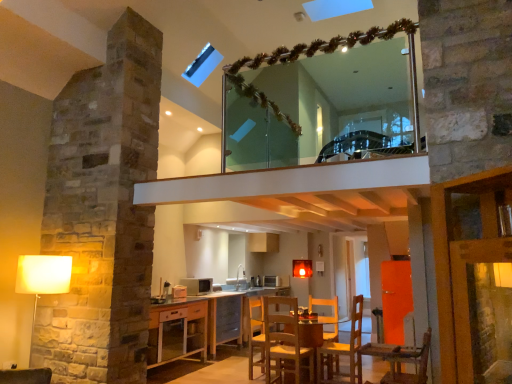
Question: From a real-world perspective, relative to wooden glass table at center, is matte white lampshade at left vertically above or below?

Choices:
 (A) above
 (B) below

Answer: (A)

Question: Is point (23, 269) closer or farther from the camera than point (312, 347)?

Choices:
 (A) closer
 (B) farther

Answer: (A)

Question: Which of these objects is positioned farthest from the clear glass mirror at upper center?

Choices:
 (A) matte white lampshade at left
 (B) matte silver microwave at center, which is the 1th appliance in left-to-right order
 (C) metallic silver microwave at center, the second appliance positioned from the front
 (D) wooden chair at lower right
 (E) wooden chair at lower center

Answer: (A)

Question: Which of these objects is positioned farthest from the wooden glass table at center?

Choices:
 (A) wooden chair at lower right
 (B) matte silver microwave at center, which appears as the second appliance when ordered from the bottom
 (C) clear glass mirror at upper center
 (D) matte white lampshade at left
 (E) metallic silver microwave at center, acting as the 1th appliance starting from the right

Answer: (C)